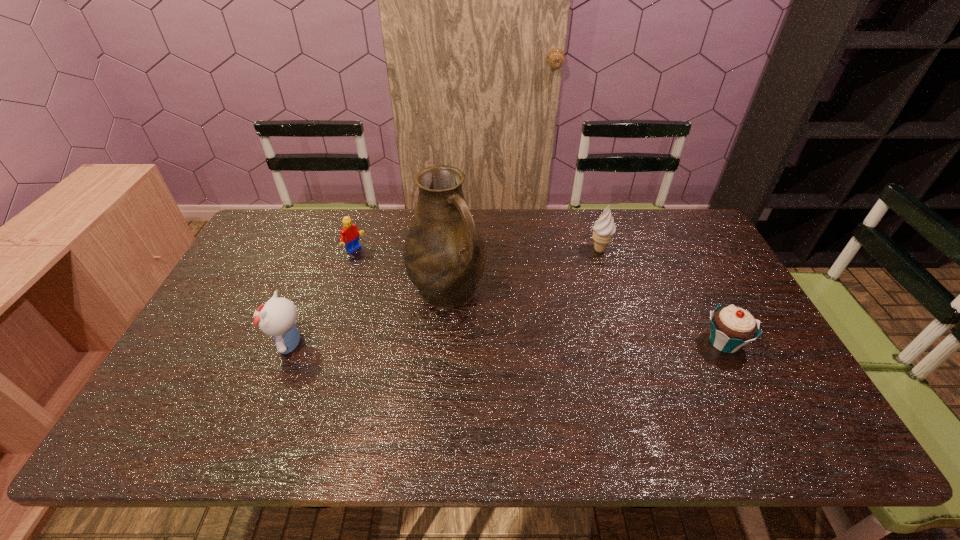
Where is `vacant area situated 0.340m on the front-facing side of the icecream`? This screenshot has width=960, height=540. vacant area situated 0.340m on the front-facing side of the icecream is located at coordinates (561, 328).

Locate an element on the screen. This screenshot has height=540, width=960. free spot located on the front-facing side of the icecream is located at coordinates (577, 295).

At what (x,y) coordinates should I click in order to perform the action: click on free space located 0.370m on the front-facing side of the icecream. Please return your answer as a coordinate pair (x, y). Image resolution: width=960 pixels, height=540 pixels. Looking at the image, I should click on click(x=557, y=335).

Find the location of a particular element. This screenshot has height=540, width=960. vacant space situated 0.100m on the front-facing side of the Lego is located at coordinates (382, 269).

The image size is (960, 540). Identify the location of vacant space located 0.130m on the front-facing side of the Lego. (388, 274).

This screenshot has width=960, height=540. In order to click on blank area located 0.150m on the front-facing side of the Lego in this screenshot , I will do pos(393,276).

The image size is (960, 540). I want to click on vacant region located 0.210m on the handle side of the third farthest object, so click(517, 363).

Find the location of a particular element. This screenshot has width=960, height=540. vacant space located on the handle side of the third farthest object is located at coordinates (507, 353).

Locate an element on the screen. free location located on the handle side of the third farthest object is located at coordinates (493, 339).

Where is `icecream at the far edge`? Image resolution: width=960 pixels, height=540 pixels. icecream at the far edge is located at coordinates (604, 228).